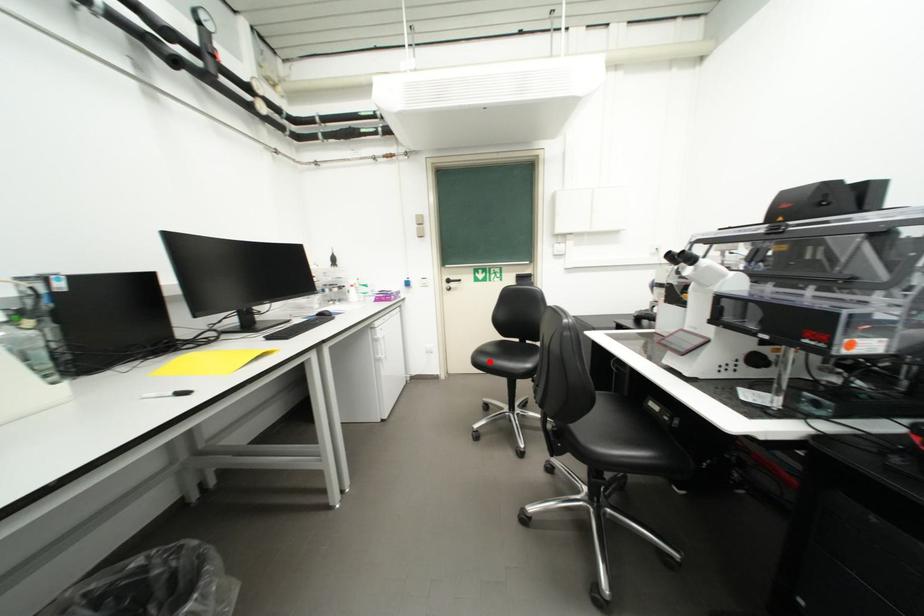
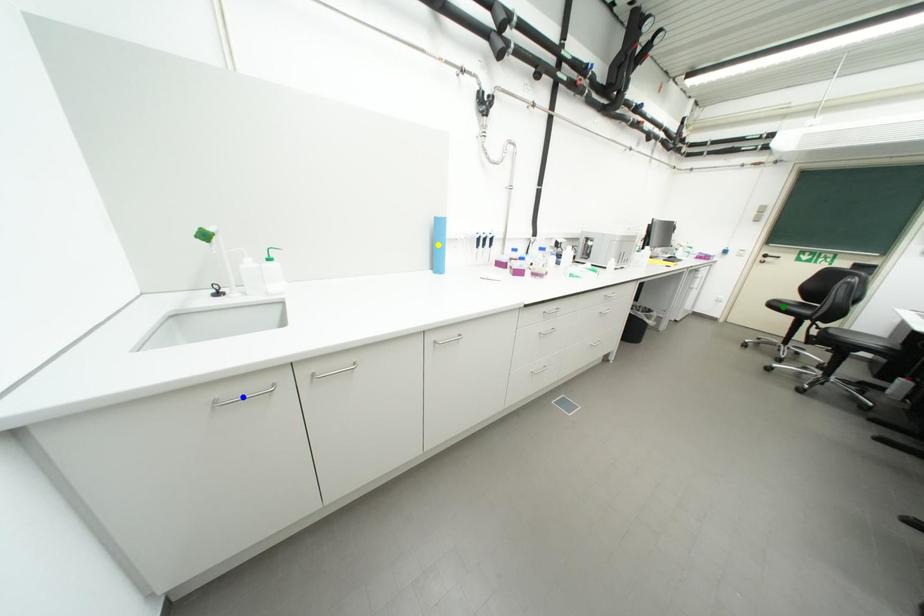
Question: I am providing you with two images of the same scene from different viewpoints. A red point is marked on the first image. You are given multiple points on the second image. In image 2, which mark is for the same physical point as the one in image 1?

Choices:
 (A) yellow point
 (B) green point
 (C) blue point

Answer: (B)